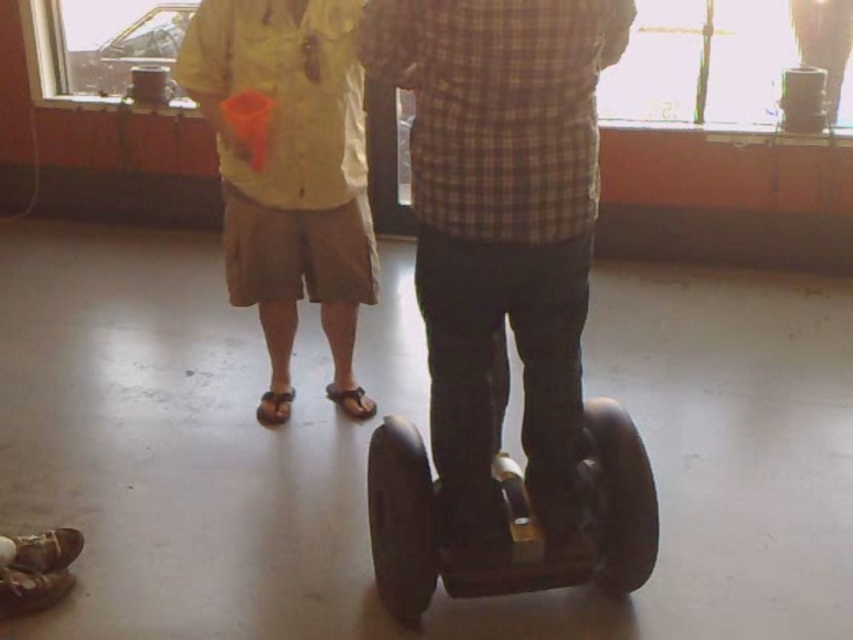
Question: Which object is positioned farthest from the matte yellow shirt at center?

Choices:
 (A) black rubber segway at center
 (B) plaid shirt at center

Answer: (A)

Question: Which object is positioned closest to the black rubber segway at center?

Choices:
 (A) plaid shirt at center
 (B) matte yellow shirt at center

Answer: (A)

Question: Is plaid shirt at center bigger than black rubber segway at center?

Choices:
 (A) no
 (B) yes

Answer: (B)

Question: Can you confirm if plaid shirt at center is positioned to the right of black rubber segway at center?

Choices:
 (A) no
 (B) yes

Answer: (A)

Question: Estimate the real-world distances between objects in this image. Which object is closer to the black rubber segway at center?

Choices:
 (A) matte yellow shirt at center
 (B) plaid shirt at center

Answer: (B)

Question: Does plaid shirt at center have a larger size compared to matte yellow shirt at center?

Choices:
 (A) no
 (B) yes

Answer: (A)